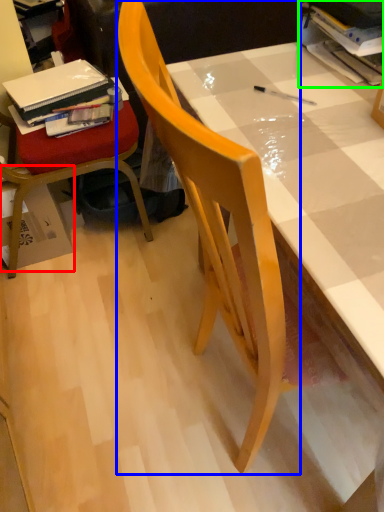
Question: Which object is the closest to the cardboard box (highlighted by a red box)? Choose among these: chair (highlighted by a blue box) or book (highlighted by a green box).

Choices:
 (A) chair
 (B) book

Answer: (A)